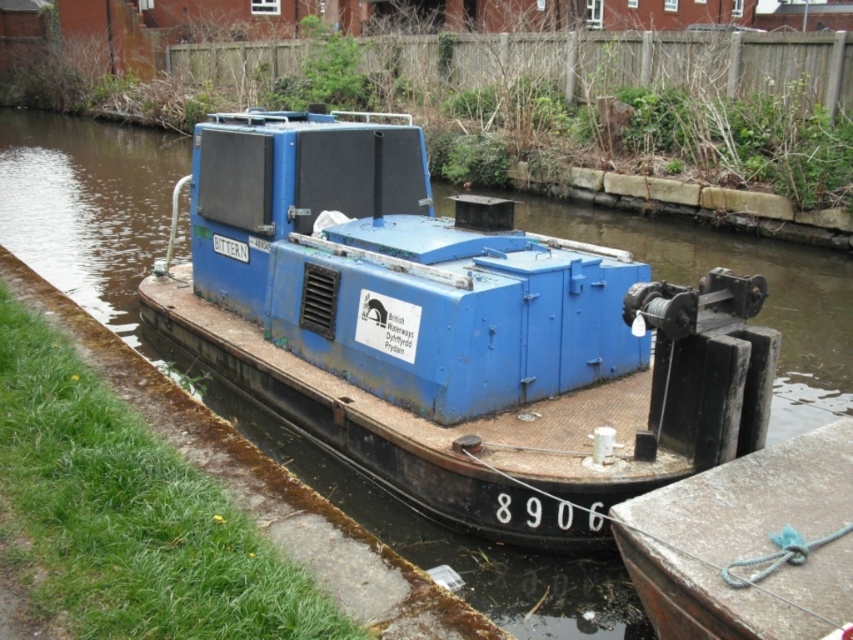
Question: Does blue matte boat at center have a greater width compared to rusty metal dock at lower right?

Choices:
 (A) yes
 (B) no

Answer: (B)

Question: Does blue matte boat at center appear on the left side of rusty metal dock at lower right?

Choices:
 (A) yes
 (B) no

Answer: (A)

Question: Is blue matte boat at center below rusty metal dock at lower right?

Choices:
 (A) yes
 (B) no

Answer: (B)

Question: Which point appears farthest from the camera in this image?

Choices:
 (A) (697, 492)
 (B) (221, 125)

Answer: (B)

Question: Which of the following is the farthest from the observer?

Choices:
 (A) rusty metal dock at lower right
 (B) blue matte boat at center

Answer: (B)

Question: Among these points, which one is nearest to the camera?

Choices:
 (A) (577, 403)
 (B) (728, 605)

Answer: (B)